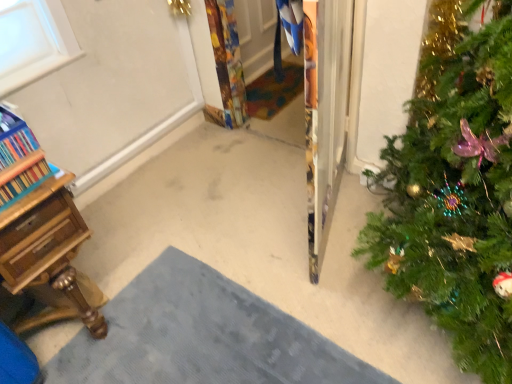
You are a GUI agent. You are given a task and a screenshot of the screen. Output one action in this format:
    pyautogui.click(x=<x>, y=<y>)
    Task: Click on the empty space that is to the right of wooden desk at lower left
    
    Given the screenshot: What is the action you would take?
    pyautogui.click(x=117, y=266)